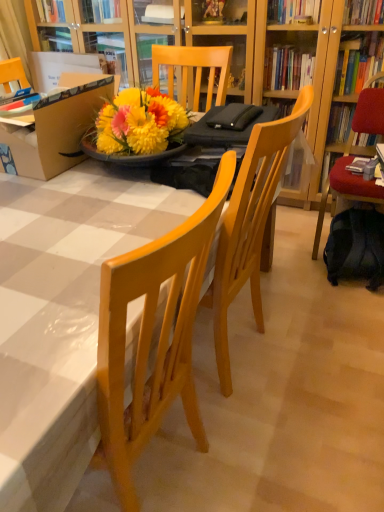
Question: Is velvet red chair at right completely or partially outside of dark blue fabric backpack at lower right?

Choices:
 (A) yes
 (B) no

Answer: (A)

Question: Can you confirm if velvet red chair at right is bigger than dark blue fabric backpack at lower right?

Choices:
 (A) yes
 (B) no

Answer: (A)

Question: From a real-world perspective, does velvet red chair at right sit lower than dark blue fabric backpack at lower right?

Choices:
 (A) yes
 (B) no

Answer: (B)

Question: From the image's perspective, is velvet red chair at right beneath dark blue fabric backpack at lower right?

Choices:
 (A) yes
 (B) no

Answer: (B)

Question: Is velvet red chair at right positioned with its back to dark blue fabric backpack at lower right?

Choices:
 (A) no
 (B) yes

Answer: (A)

Question: In terms of width, does hardcover book at right look wider or thinner when compared to velvet red chair at right?

Choices:
 (A) thin
 (B) wide

Answer: (A)

Question: Considering the positions of point (365, 165) and point (340, 179), is point (365, 165) closer or farther from the camera than point (340, 179)?

Choices:
 (A) farther
 (B) closer

Answer: (A)

Question: From the image's perspective, relative to velvet red chair at right, is hardcover book at right above or below?

Choices:
 (A) below
 (B) above

Answer: (B)

Question: Which is correct: hardcover book at right is inside velvet red chair at right, or outside of it?

Choices:
 (A) inside
 (B) outside

Answer: (A)

Question: Is velvet red chair at right in front of or behind hardcover book at right in the image?

Choices:
 (A) front
 (B) behind

Answer: (A)

Question: From their relative heights in the image, would you say velvet red chair at right is taller or shorter than hardcover book at right?

Choices:
 (A) short
 (B) tall

Answer: (B)

Question: Is velvet red chair at right situated inside hardcover book at right or outside?

Choices:
 (A) inside
 (B) outside

Answer: (B)

Question: From the image's perspective, is velvet red chair at right located above or below hardcover book at right?

Choices:
 (A) below
 (B) above

Answer: (A)

Question: Does point (8, 170) appear closer or farther from the camera than point (9, 250)?

Choices:
 (A) farther
 (B) closer

Answer: (A)

Question: Would you say matte cardboard box at upper left is inside or outside wooden table at center?

Choices:
 (A) outside
 (B) inside

Answer: (A)